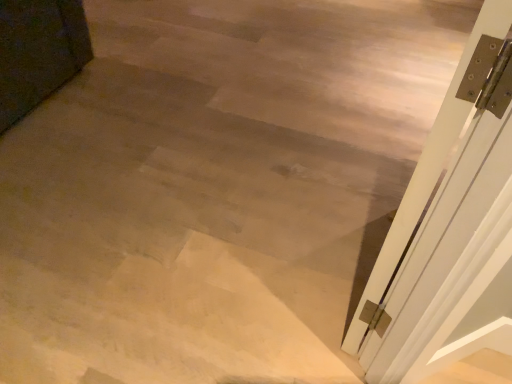
This screenshot has width=512, height=384. I want to click on white glossy door at right, so click(x=453, y=226).

This screenshot has width=512, height=384. Describe the element at coordinates (453, 226) in the screenshot. I see `white glossy door at right` at that location.

What is the approximate height of white glossy door at right?

white glossy door at right is 3.37 feet tall.

At what (x,y) coordinates should I click in order to perform the action: click on white glossy door at right. Please return your answer as a coordinate pair (x, y). Looking at the image, I should click on (453, 226).